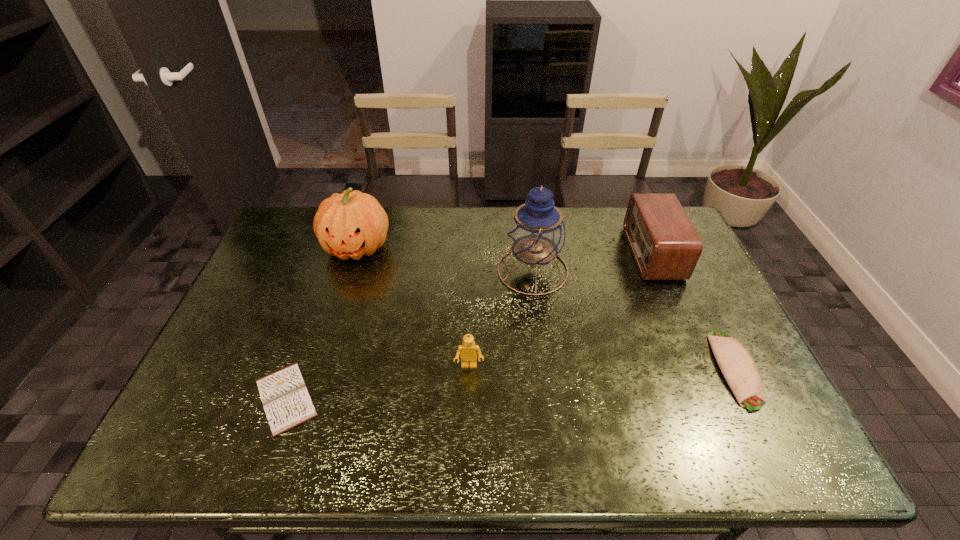
Where is `vacant area situated on the front-facing side of the third object from right to left`? The image size is (960, 540). vacant area situated on the front-facing side of the third object from right to left is located at coordinates (400, 271).

Identify the location of free space located on the carved face of the second tallest object. The width and height of the screenshot is (960, 540). (342, 298).

Find the location of a particular element. vacant space located on the front panel of the third tallest object is located at coordinates (589, 253).

At what (x,y) coordinates should I click in order to perform the action: click on blank space located 0.320m on the front panel of the third tallest object. Please return your answer as a coordinate pair (x, y). This screenshot has width=960, height=540. Looking at the image, I should click on (536, 253).

Image resolution: width=960 pixels, height=540 pixels. In order to click on free region located 0.240m on the front panel of the third tallest object in this screenshot , I will do `click(560, 253)`.

Image resolution: width=960 pixels, height=540 pixels. I want to click on vacant space located on the face of the fourth tallest object, so click(x=468, y=419).

This screenshot has width=960, height=540. Identify the location of vacant area situated 0.080m at the bitten end of the second shortest object. (772, 445).

Where is `free region located on the right of the diary`? The width and height of the screenshot is (960, 540). free region located on the right of the diary is located at coordinates (421, 397).

The width and height of the screenshot is (960, 540). I want to click on lantern present at the far edge, so click(x=536, y=234).

The width and height of the screenshot is (960, 540). I want to click on pumpkin present at the far edge, so click(352, 224).